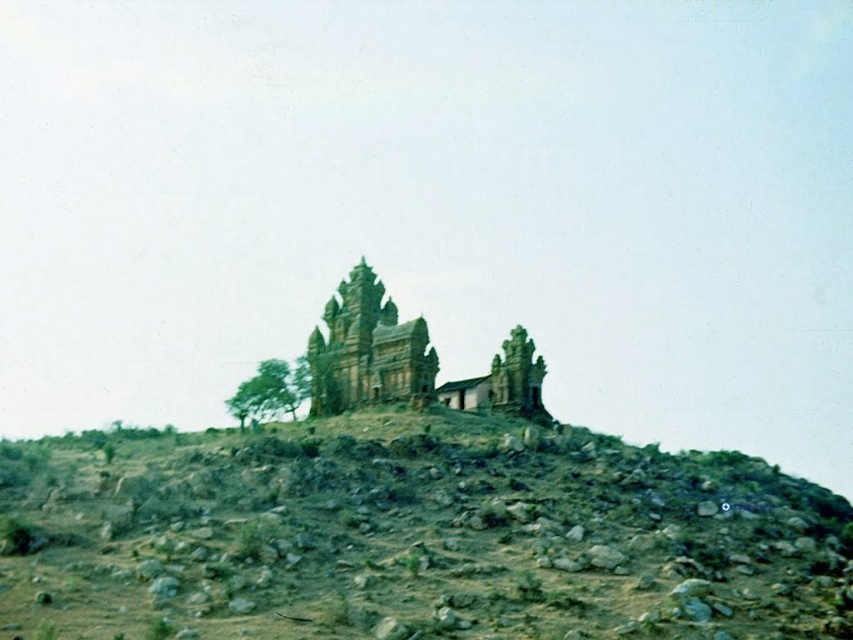
You are a hiker standing at the base of the hill. You want to reach the brown stone ruins at center. Which direction should you move relative to the brown rocky hillside at center?

You should move away from the brown rocky hillside at center because the brown stone ruins at center are further away from the viewer than the brown rocky hillside at center.

You are standing at the base of the hill where the temple is located. You want to reach the brown stone ruins at center. According to the coordinates provided, in which direction should you move relative to your current position?

The brown stone ruins at center are located at coordinates point (x=367, y=349). Since you are at the base of the hill, you should move towards the center of the image to reach them.